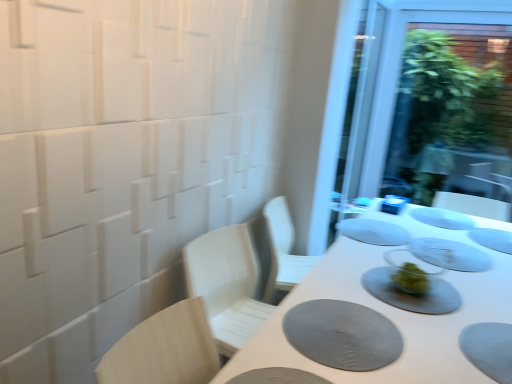
This screenshot has width=512, height=384. Find the location of `free space to the right of matte gray placemat at center, the first tableware in the front-to-back sequence`. free space to the right of matte gray placemat at center, the first tableware in the front-to-back sequence is located at coordinates (476, 291).